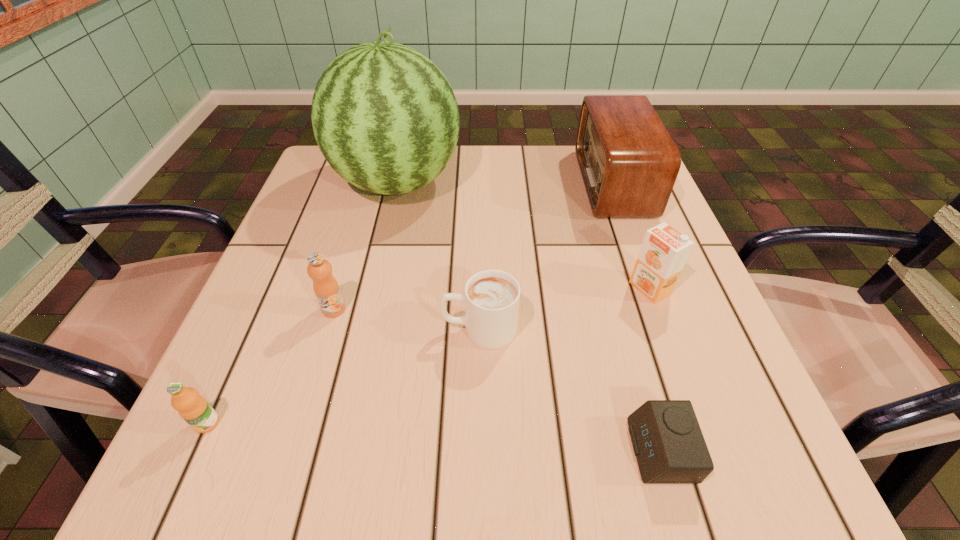
At what (x,y) coordinates should I click in order to perform the action: click on the tallest object. Please return your answer as a coordinate pair (x, y). Image resolution: width=960 pixels, height=540 pixels. Looking at the image, I should click on (384, 116).

Locate an element on the screen. radio receiver is located at coordinates point(629,163).

The height and width of the screenshot is (540, 960). In order to click on the rightmost orange juice in this screenshot , I will do `click(664, 251)`.

Locate an element on the screen. the second orange juice from left to right is located at coordinates (326, 288).

Identify the location of cappuccino. The image size is (960, 540). (491, 298).

Identify the location of the leftmost orange juice. (193, 408).

In order to click on the nearest orange juice in this screenshot , I will do `click(193, 408)`.

This screenshot has height=540, width=960. Identify the location of the shortest object. (667, 440).

What are the coordinates of `vacant region located on the front of the tallest object` in the screenshot? It's located at (363, 335).

In order to click on free spot located on the front panel of the radio receiver in this screenshot , I will do `click(419, 183)`.